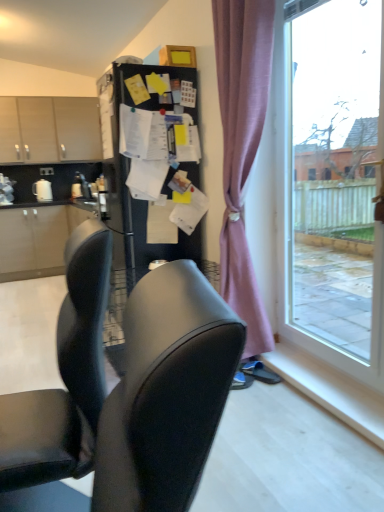
This screenshot has width=384, height=512. What are the coordinates of `free location above blue suede shoes at lower right (from a real-world perspective)` in the screenshot? It's located at (255, 364).